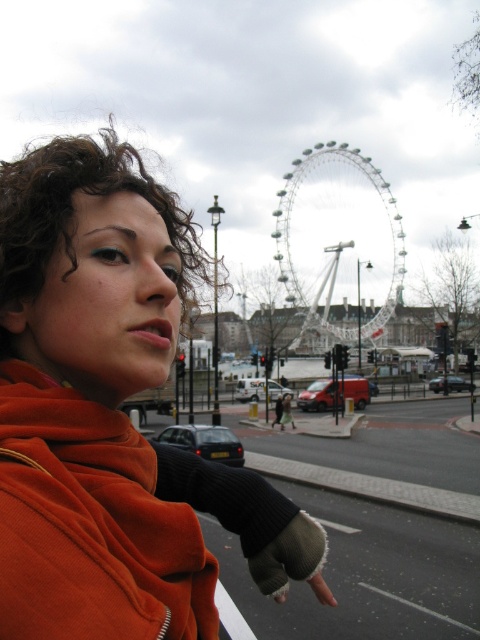
Who is lower down, orange fleece jacket at center or white metallic ferris wheel at center?

orange fleece jacket at center is below.

Describe the element at coordinates (92, 401) in the screenshot. I see `orange fleece jacket at center` at that location.

Is point (163, 499) positioned before point (402, 253)?

That is True.

This screenshot has height=640, width=480. In order to click on orange fleece jacket at center in this screenshot , I will do `click(92, 401)`.